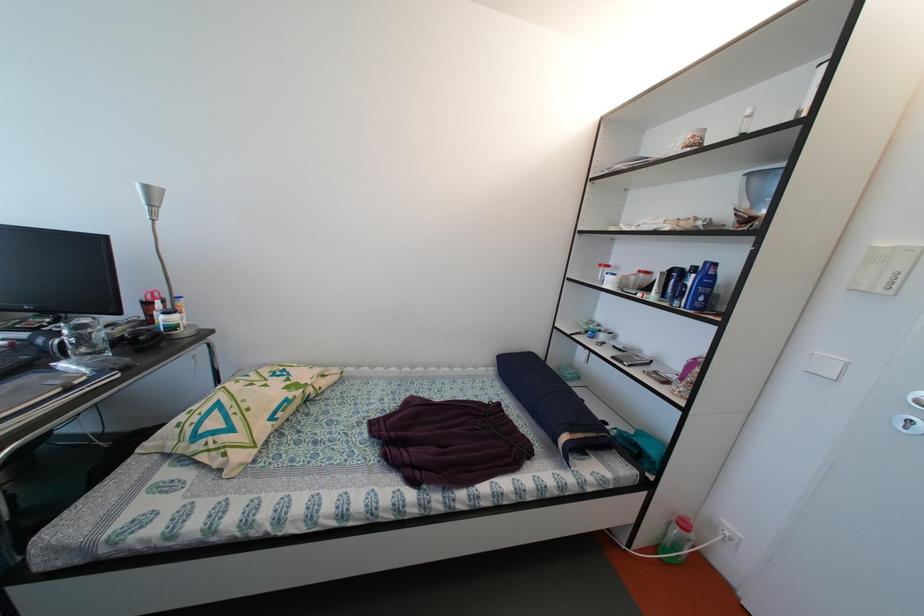
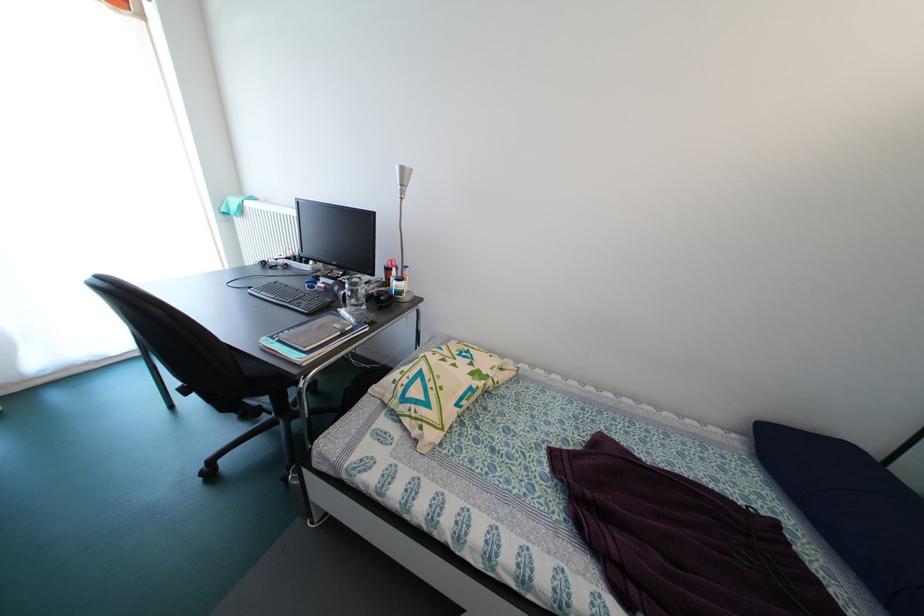
The point at (106,341) is marked in the first image. Where is the corresponding point in the second image?

(369, 297)